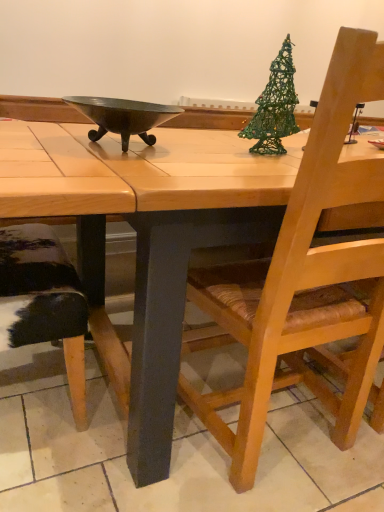
This screenshot has width=384, height=512. I want to click on free space on the front side of green wire christmas tree at upper right, so (x=254, y=165).